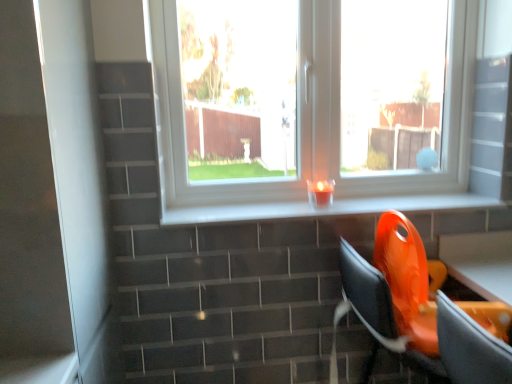
Question: Can we say white glossy window sill at center lies outside orange plastic swivel chair at lower right?

Choices:
 (A) yes
 (B) no

Answer: (A)

Question: Is white glossy window sill at center positioned with its back to orange plastic swivel chair at lower right?

Choices:
 (A) yes
 (B) no

Answer: (B)

Question: Is white glossy window sill at center shorter than orange plastic swivel chair at lower right?

Choices:
 (A) no
 (B) yes

Answer: (B)

Question: Is white glossy window sill at center behind orange plastic swivel chair at lower right?

Choices:
 (A) no
 (B) yes

Answer: (B)

Question: Considering the relative sizes of white glossy window sill at center and orange plastic swivel chair at lower right in the image provided, is white glossy window sill at center wider than orange plastic swivel chair at lower right?

Choices:
 (A) yes
 (B) no

Answer: (B)

Question: Does white glossy window sill at center come in front of orange plastic swivel chair at lower right?

Choices:
 (A) no
 (B) yes

Answer: (A)

Question: Considering the relative positions of white glossy window sill at center and white glossy screen door at left in the image provided, is white glossy window sill at center to the left of white glossy screen door at left from the viewer's perspective?

Choices:
 (A) no
 (B) yes

Answer: (A)

Question: Does white glossy window sill at center have a lesser width compared to white glossy screen door at left?

Choices:
 (A) yes
 (B) no

Answer: (A)

Question: Can you confirm if white glossy window sill at center is positioned to the right of white glossy screen door at left?

Choices:
 (A) yes
 (B) no

Answer: (A)

Question: From the image's perspective, does white glossy window sill at center appear higher than white glossy screen door at left?

Choices:
 (A) yes
 (B) no

Answer: (A)

Question: Does white glossy window sill at center have a greater width compared to white glossy screen door at left?

Choices:
 (A) no
 (B) yes

Answer: (A)

Question: Considering the relative sizes of white glossy window sill at center and white glossy screen door at left in the image provided, is white glossy window sill at center shorter than white glossy screen door at left?

Choices:
 (A) yes
 (B) no

Answer: (A)

Question: Is white glossy screen door at left behind white glossy window sill at center?

Choices:
 (A) yes
 (B) no

Answer: (B)